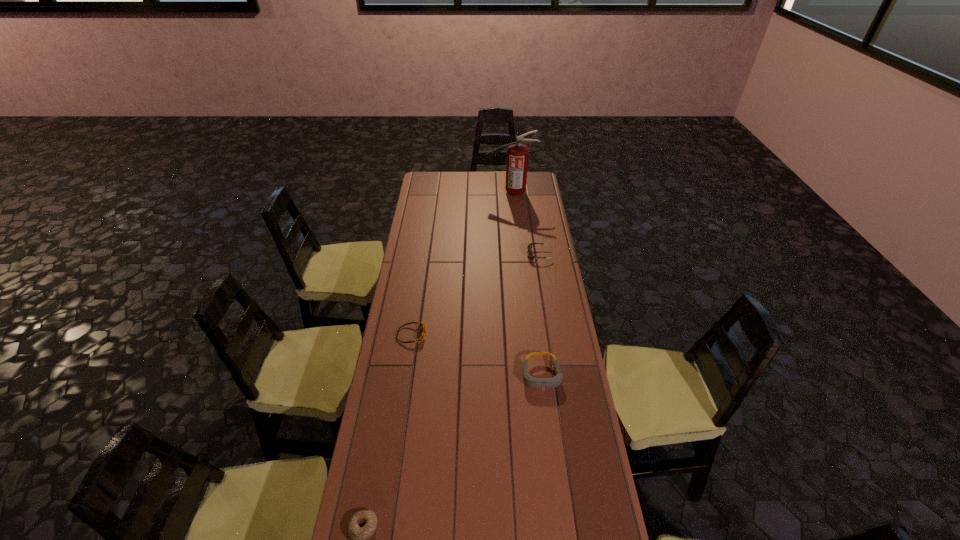
Select which goggles appears as the second closest to the second farthest object. Please provide its 2D coordinates. Your answer should be formatted as a tuple, i.e. [(x, y)], where the tuple contains the x and y coordinates of a point satisfying the conditions above.

[(423, 327)]

Find the location of a particular element. The image size is (960, 540). goggles that is the third nearest to the nearest object is located at coordinates (529, 247).

You are a GUI agent. You are given a task and a screenshot of the screen. Output one action in this format:
    pyautogui.click(x=<x>, y=<y>)
    Task: Click on the free space that satisfies the following two spatial constraints: 1. on the lenses of the second farthest object; 2. on the front and back of the fourth shortest object
    
    Given the screenshot: What is the action you would take?
    pyautogui.click(x=559, y=375)

Find the location of a particular element. This screenshot has width=960, height=540. vacant point that satisfies the following two spatial constraints: 1. on the lenses of the farthest goggles; 2. on the front and back of the tallest goggles is located at coordinates (559, 375).